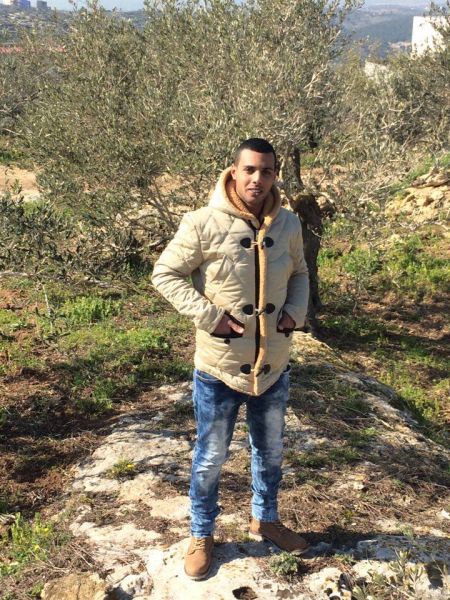
You are a GUI agent. You are given a task and a screenshot of the screen. Output one action in this format:
    pyautogui.click(x=<x>, y=<y>)
    Task: Click on the coat
    This screenshot has height=600, width=450.
    Given the screenshot: What is the action you would take?
    pyautogui.click(x=278, y=291)